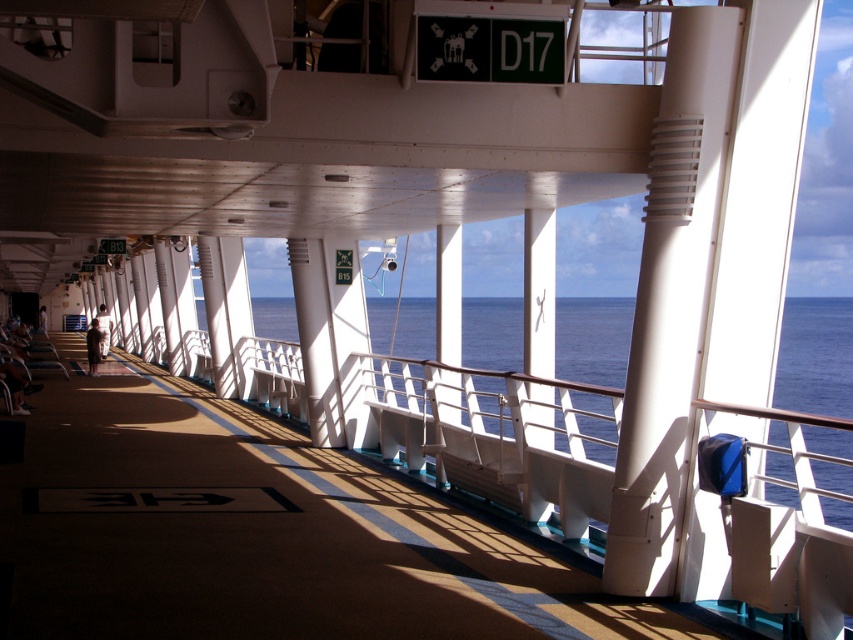
Looking at this image, which is above, blue water at center or dark brown leather jacket at left?

dark brown leather jacket at left is higher up.

Does blue water at center appear on the right side of dark brown leather jacket at left?

Indeed, blue water at center is positioned on the right side of dark brown leather jacket at left.

Describe the element at coordinates (815, 356) in the screenshot. I see `blue water at center` at that location.

The width and height of the screenshot is (853, 640). What are the coordinates of `blue water at center` in the screenshot? It's located at (815, 356).

Can you confirm if dark brown leather jacket at left is positioned below white fabric person at center?

No.

Is dark brown leather jacket at left positioned behind white fabric person at center?

No, it is not.

This screenshot has width=853, height=640. What are the coordinates of `dark brown leather jacket at left` in the screenshot? It's located at (93, 346).

Find the location of a particular element. brown carpet at center is located at coordinates (250, 534).

Who is more forward, (x=141, y=433) or (x=90, y=344)?

Positioned in front is point (x=141, y=433).

Locate an element on the screen. The image size is (853, 640). brown carpet at center is located at coordinates (250, 534).